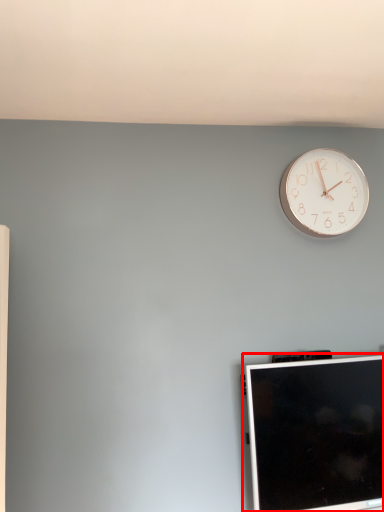
Question: From the image's perspective, what is the correct spatial positioning of computer monitor (annotated by the red box) in reference to wall clock?

Choices:
 (A) above
 (B) below

Answer: (B)